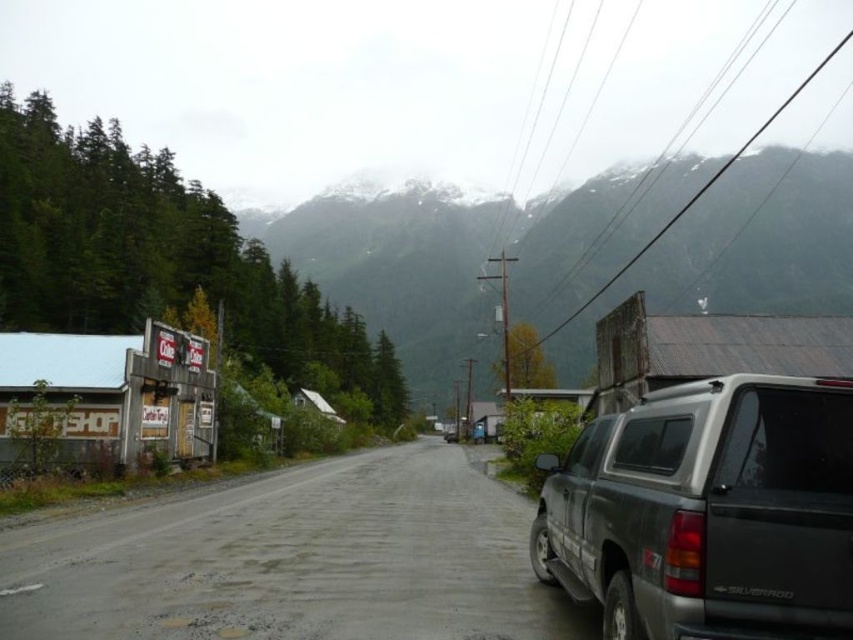
Is snowy rock mountain at upper center positioned before matte gray minivan at right?

No, it is behind matte gray minivan at right.

The image size is (853, 640). In order to click on snowy rock mountain at upper center in this screenshot , I will do `click(741, 250)`.

Identify the location of snowy rock mountain at upper center. The height and width of the screenshot is (640, 853). (741, 250).

Is point (802, 403) positioned after point (653, 566)?

That is False.

How much distance is there between matte gray minivan at right and black plastic license plate at right?

matte gray minivan at right is 13.39 meters from black plastic license plate at right.

Locate an element on the screen. This screenshot has width=853, height=640. matte gray minivan at right is located at coordinates (708, 512).

The height and width of the screenshot is (640, 853). In order to click on matte gray minivan at right in this screenshot , I will do coord(708,512).

Who is shorter, snowy rock mountain at upper center or black plastic license plate at right?

With less height is black plastic license plate at right.

Which is behind, point (485, 237) or point (648, 561)?

Point (485, 237)

Is point (554, 362) closer to camera compared to point (656, 556)?

That is False.

The height and width of the screenshot is (640, 853). I want to click on snowy rock mountain at upper center, so click(x=741, y=250).